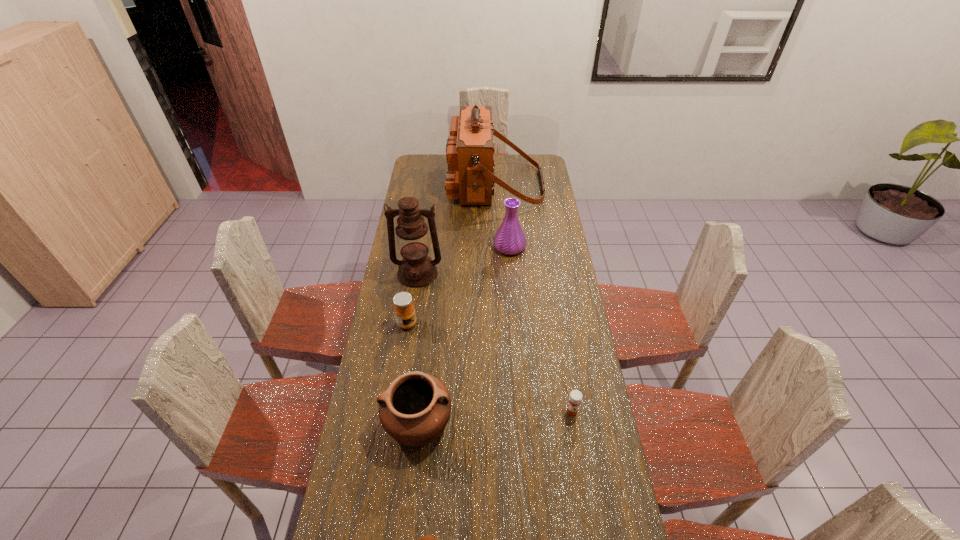
You are a GUI agent. You are given a task and a screenshot of the screen. Output one action in this format:
    pyautogui.click(x=<x>, y=<y>)
    Task: Click on the satchel located in the right edge section of the desktop
    
    Given the screenshot: What is the action you would take?
    pyautogui.click(x=470, y=177)

Where is `medicine present at the right edge`? medicine present at the right edge is located at coordinates (575, 397).

Find the location of a particular element. The width and height of the screenshot is (960, 540). object that is at the far right corner is located at coordinates (470, 177).

The width and height of the screenshot is (960, 540). In the image, there is a desktop. In order to click on free space at the left edge in this screenshot , I will do `click(371, 494)`.

Find the location of a particular element. The width and height of the screenshot is (960, 540). vacant space at the right edge of the desktop is located at coordinates (536, 181).

Locate an element on the screen. vacant space at the far right corner of the desktop is located at coordinates (522, 158).

Locate an element on the screen. free area in between the fourth farthest object and the farthest object is located at coordinates (451, 254).

The image size is (960, 540). What are the coordinates of `free space that is in between the farthest object and the pottery` in the screenshot? It's located at (457, 303).

Find the location of a particular element. free area in between the oil lamp and the fifth shortest object is located at coordinates (464, 260).

This screenshot has width=960, height=540. Find the location of `vacant space that's between the second shortest object and the fourth nearest object`. vacant space that's between the second shortest object and the fourth nearest object is located at coordinates (490, 367).